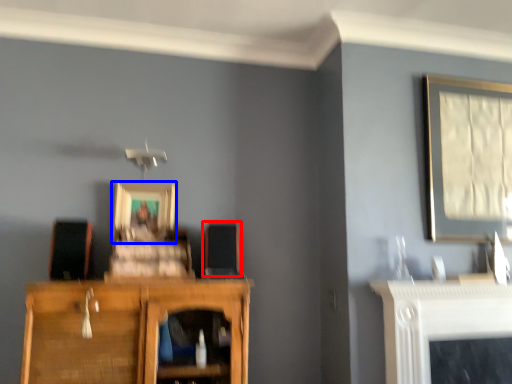
Question: Among these objects, which one is nearest to the camera, speaker (highlighted by a red box) or picture frame (highlighted by a blue box)?

Choices:
 (A) speaker
 (B) picture frame

Answer: (A)